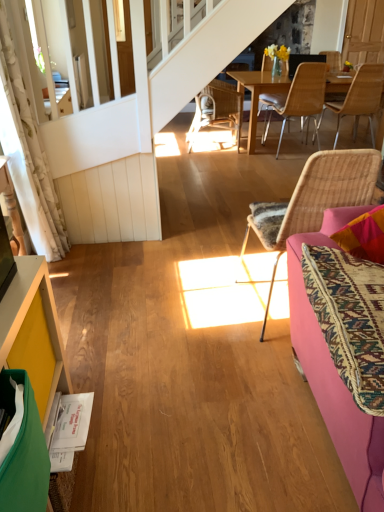
Question: From the image's perspective, relative to pink fabric couch at right, is white floral fabric curtain at left above or below?

Choices:
 (A) above
 (B) below

Answer: (A)

Question: Does point (3, 47) appear closer or farther from the camera than point (322, 370)?

Choices:
 (A) farther
 (B) closer

Answer: (A)

Question: Based on their relative distances, which object is nearer to the pink fabric couch at right?

Choices:
 (A) yellow painted wood cabinet at lower left
 (B) woven rattan chair at center, the fourth chair when ordered from front to back
 (C) light brown wicker chair at upper right, which appears as the first chair when viewed from the right
 (D) woven rattan chair at center, arranged as the 4th chair when viewed from the back
 (E) woven wood chair at center, positioned as the second chair in front-to-back order

Answer: (D)

Question: Which object is the farthest from the woven rattan chair at center, arranged as the 4th chair when viewed from the back?

Choices:
 (A) pink fabric couch at right
 (B) yellow painted wood cabinet at lower left
 (C) woven wood chair at center, positioned as the second chair in front-to-back order
 (D) woven rattan chair at center, acting as the fourth chair starting from the right
 (E) white floral fabric curtain at left

Answer: (D)